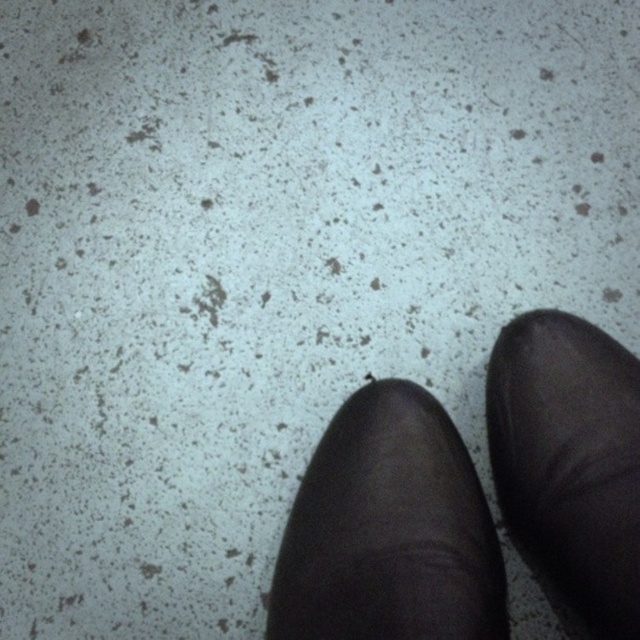
You are a robot trying to navigate to the black leather shoe at center. The coordinates of the shoe are given as point (388,531). If your current position is at point 0.5, 0.5, in which direction should you move to reach the shoe?

The black leather shoe at center is located at point (388,531). Since your current position is at 0.5, 0.5, you should move northeast to reach the shoe.

You are a delivery robot with a 15 cm wide package. You need to place the package between the black leather shoe at center and the black leather shoe at lower right. Is there enough space?

The black leather shoe at center is 12.32 centimeters away from the black leather shoe at lower right. Since the package is 15 cm wide, which is wider than the available space, the package cannot be placed between them.

You are standing in a dimly lit room with a speckled floor. You notice two points marked on the floor at coordinates point (365, 531) and point (605, 518). If you look down at your feet, which point appears closer to your eyes?

Point (365, 531) is further to the camera than point (605, 518), so the point (605, 518) appears closer to your eyes.